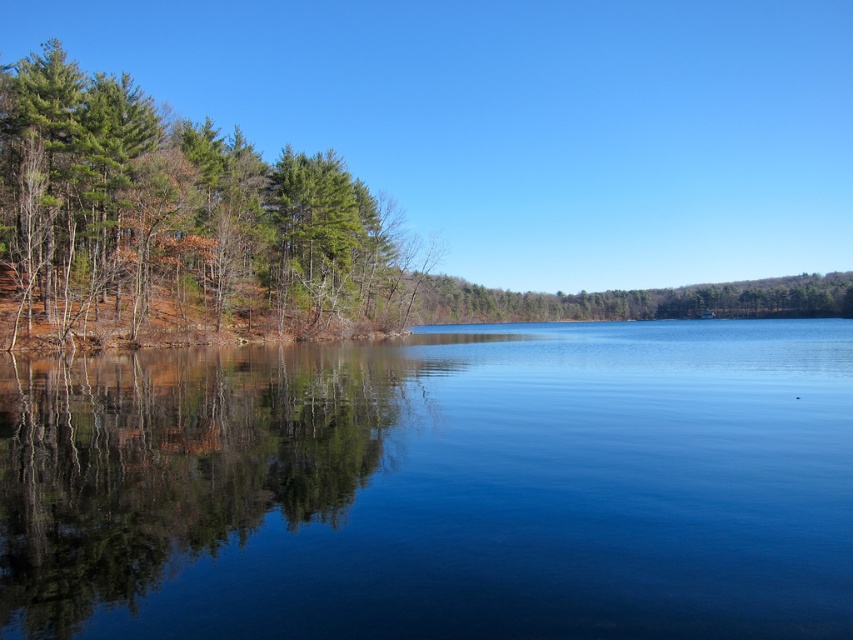
Question: From the image, what is the correct spatial relationship of clear water at center in relation to green matte tree at left?

Choices:
 (A) right
 (B) left

Answer: (A)

Question: Among these objects, which one is farthest from the camera?

Choices:
 (A) green matte tree at left
 (B) green matte trees at left
 (C) clear water at center

Answer: (A)

Question: Which point is closer to the camera?

Choices:
 (A) green matte trees at left
 (B) green matte tree at left
 (C) clear water at center

Answer: (C)

Question: Which point is closer to the camera taking this photo?

Choices:
 (A) (9, 184)
 (B) (4, 596)

Answer: (B)

Question: Is green matte tree at left smaller than green matte trees at left?

Choices:
 (A) no
 (B) yes

Answer: (A)

Question: Does green matte tree at left appear on the left side of green matte trees at left?

Choices:
 (A) no
 (B) yes

Answer: (B)